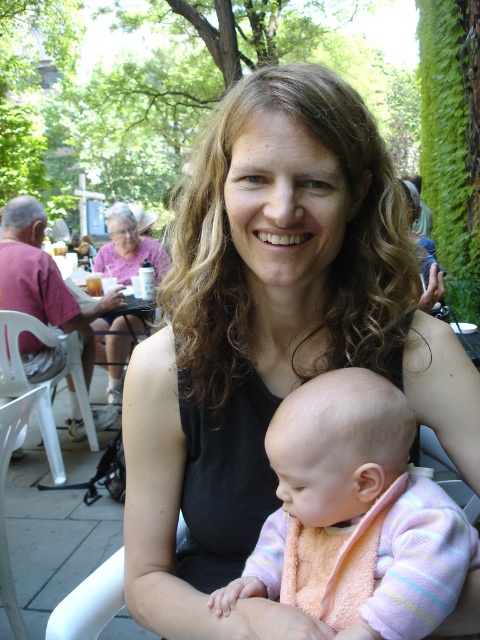
Is the position of pastel striped sweater at center less distant than that of matte pink shirt at upper left?

Yes, pastel striped sweater at center is closer to the viewer.

Who is lower down, pastel striped sweater at center or matte pink shirt at upper left?

Positioned lower is pastel striped sweater at center.

Find the location of a particular element. pastel striped sweater at center is located at coordinates (325, 467).

Between point (52, 342) and point (117, 362), which one is positioned behind?

Positioned behind is point (117, 362).

Is point (78, 394) positioned in front of point (116, 371)?

Yes, it is in front of point (116, 371).

This screenshot has height=640, width=480. Identify the location of white plastic chair at lower left. (43, 380).

Between black fabric tank top at center and matte pink shirt at upper left, which one is positioned higher?

matte pink shirt at upper left is above.

Between black fabric tank top at center and matte pink shirt at upper left, which one is positioned lower?

black fabric tank top at center is lower down.

The height and width of the screenshot is (640, 480). Describe the element at coordinates (271, 337) in the screenshot. I see `black fabric tank top at center` at that location.

The image size is (480, 640). Find the location of `black fabric tank top at center`. black fabric tank top at center is located at coordinates (271, 337).